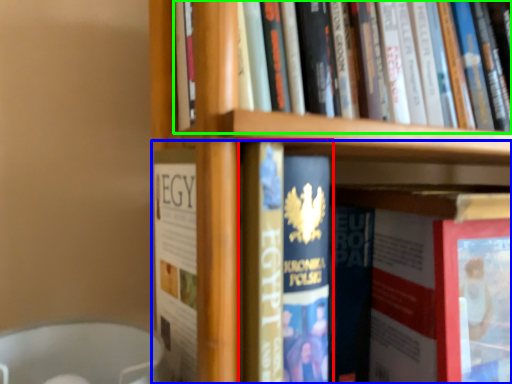
Question: Based on their relative distances, which object is farther from book (highlighted by a red box)? Choose from book (highlighted by a blue box) and book (highlighted by a green box).

Choices:
 (A) book
 (B) book

Answer: (B)